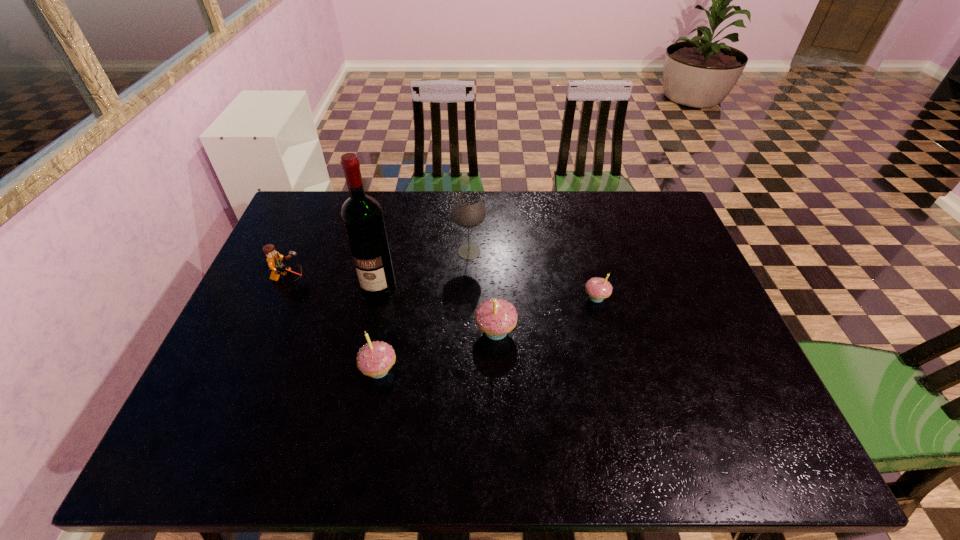
What are the coordinates of `the second tallest cupcake` in the screenshot? It's located at (375, 359).

Where is `the leftmost cupcake`? the leftmost cupcake is located at coordinates (375, 359).

What are the coordinates of `the second nearest cupcake` in the screenshot? It's located at (495, 317).

The image size is (960, 540). Identify the location of the second nearest object. (495, 317).

The image size is (960, 540). Identify the location of the shortest object. (598, 289).

Locate an element on the screen. This screenshot has height=540, width=960. the shortest cupcake is located at coordinates (598, 289).

The height and width of the screenshot is (540, 960). Identify the location of Lego. (274, 259).

At what (x,y) coordinates should I click in order to perform the action: click on the tallest object. Please return your answer as a coordinate pair (x, y). The height and width of the screenshot is (540, 960). Looking at the image, I should click on (362, 218).

The image size is (960, 540). Find the location of `the farthest object`. the farthest object is located at coordinates (468, 210).

Where is `the fifth shortest object`? This screenshot has width=960, height=540. the fifth shortest object is located at coordinates tap(468, 210).